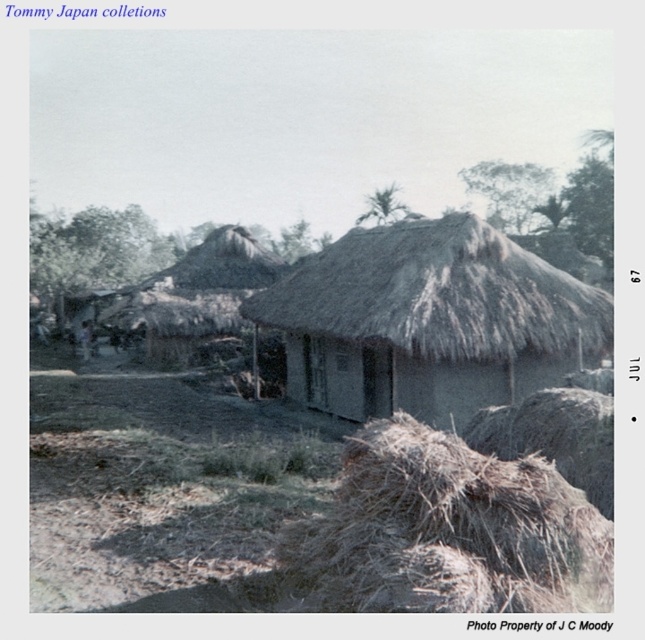
Question: In this image, where is thatched straw hut at center located relative to brown straw at lower right?

Choices:
 (A) right
 (B) left

Answer: (B)

Question: Which point appears closest to the camera in this image?

Choices:
 (A) (584, 292)
 (B) (548, 566)

Answer: (B)

Question: Which object appears closest to the camera in this image?

Choices:
 (A) thatched straw hut at center
 (B) brown straw at lower right

Answer: (B)

Question: Does thatched straw hut at center appear on the left side of brown straw at lower right?

Choices:
 (A) no
 (B) yes

Answer: (B)

Question: Can you confirm if thatched straw hut at center is thinner than brown straw at lower right?

Choices:
 (A) yes
 (B) no

Answer: (B)